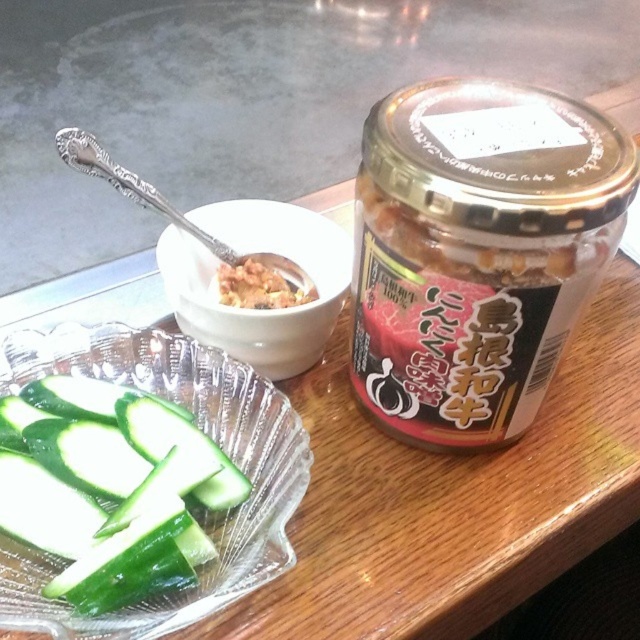
Question: Can you confirm if transparent glass jar at right is positioned to the left of green smooth cucumber at lower left?

Choices:
 (A) yes
 (B) no

Answer: (B)

Question: Among these points, which one is farthest from the camera?

Choices:
 (A) (266, 218)
 (B) (401, 394)
 (C) (109, 573)

Answer: (A)

Question: Which object is farther from the camera taking this photo?

Choices:
 (A) transparent glass jar at right
 (B) white creamy paste at center
 (C) green smooth cucumber at lower left

Answer: (B)

Question: Is transparent glass jar at right further to the viewer compared to green smooth cucumber at lower left?

Choices:
 (A) yes
 (B) no

Answer: (B)

Question: From the image, what is the correct spatial relationship of white ceramic bowl at center in relation to white creamy paste at center?

Choices:
 (A) above
 (B) below

Answer: (A)

Question: Which point appears farthest from the camera in this image?

Choices:
 (A) (17, 492)
 (B) (566, 147)

Answer: (A)